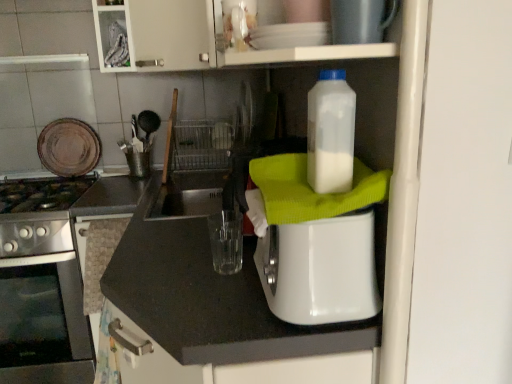
Locate an element on the screen. stainless steel gas stove at lower left is located at coordinates (38, 215).

What are the coordinates of `translucent plastic bottle at upper right` in the screenshot? It's located at (331, 133).

Describe the element at coordinates (331, 133) in the screenshot. The height and width of the screenshot is (384, 512). I see `translucent plastic bottle at upper right` at that location.

Measure the distance between point (10, 276) and camera.

The depth of point (10, 276) is 6.07 feet.

Describe the element at coordinates (198, 39) in the screenshot. The height and width of the screenshot is (384, 512). I see `white matte cabinet at upper center` at that location.

Find the location of a particular element. The height and width of the screenshot is (384, 512). stainless steel gas stove at lower left is located at coordinates (38, 215).

From the picture: Between brown matte plate at upper left, which is the third appliance in front-to-back order, and translucent plastic bottle at upper right, which one has larger width?

Wider between the two is translucent plastic bottle at upper right.

From the image's perspective, is brown matte plate at upper left, arranged as the first appliance when viewed from the left, positioned above or below translucent plastic bottle at upper right?

From the image's perspective, brown matte plate at upper left, arranged as the first appliance when viewed from the left, appears above translucent plastic bottle at upper right.

Does brown matte plate at upper left, the first appliance from the back, touch translucent plastic bottle at upper right?

No, brown matte plate at upper left, the first appliance from the back, is not in contact with translucent plastic bottle at upper right.

Does point (59, 169) appear closer or farther from the camera than point (349, 86)?

Point (59, 169).

From the image's perspective, which object appears higher, brown matte plate at upper left, the first appliance from the back, or stainless steel oven at left?

From the image's view, brown matte plate at upper left, the first appliance from the back, is above.

I want to click on home appliance lying below the brown matte plate at upper left, which is the third appliance in front-to-back order (from the image's perspective), so click(x=41, y=285).

From a real-world perspective, does stainless steel gas stove at lower left stand above brown matte plate at upper left, which is the third appliance in front-to-back order?

No, from a real-world perspective, stainless steel gas stove at lower left is not over brown matte plate at upper left, which is the third appliance in front-to-back order

Does point (22, 243) come farther from viewer compared to point (62, 135)?

No, it is not.

Is stainless steel gas stove at lower left at the left side of brown matte plate at upper left, arranged as the first appliance when viewed from the left?

Correct, you'll find stainless steel gas stove at lower left to the left of brown matte plate at upper left, arranged as the first appliance when viewed from the left.

Is stainless steel gas stove at lower left positioned far away from brown matte plate at upper left, which is counted as the third appliance, starting from the right?

stainless steel gas stove at lower left is near brown matte plate at upper left, which is counted as the third appliance, starting from the right, not far away.

Considering the sizes of objects white plastic toaster at center, the second appliance from the left, and translucent plastic bottle at upper right in the image provided, who is shorter, white plastic toaster at center, the second appliance from the left, or translucent plastic bottle at upper right?

translucent plastic bottle at upper right is shorter.

Is white plastic toaster at center, which ranks as the 2th appliance in back-to-front order, positioned with its back to translucent plastic bottle at upper right?

white plastic toaster at center, which ranks as the 2th appliance in back-to-front order, is not turned away from translucent plastic bottle at upper right.

Is white plastic toaster at center, which ranks as the second appliance in right-to-left order, spatially inside translucent plastic bottle at upper right, or outside of it?

The correct answer is: outside.

This screenshot has width=512, height=384. I want to click on appliance that appears below the translucent plastic bottle at upper right (from the image's perspective), so click(x=317, y=243).

Is translucent plastic bottle at upper right oriented towards white matte cabinet at upper center?

No.

Considering the relative sizes of translucent plastic bottle at upper right and white matte cabinet at upper center in the image provided, is translucent plastic bottle at upper right bigger than white matte cabinet at upper center?

Actually, translucent plastic bottle at upper right might be smaller than white matte cabinet at upper center.

The width and height of the screenshot is (512, 384). Identify the location of bottle in front of the white matte cabinet at upper center. (331, 133).

Between point (44, 187) and point (381, 33), which one is positioned behind?

The point (44, 187) is farther from the camera.

Is stainless steel oven at left situated inside metallic silver toaster at upper center, the third appliance when ordered from left to right, or outside?

stainless steel oven at left is located beyond the bounds of metallic silver toaster at upper center, the third appliance when ordered from left to right.

From the image's perspective, starting from the stainless steel oven at left, which appliance is the 3rd one above? Please provide its 2D coordinates.

[(360, 20)]

Is stainless steel oven at left beside metallic silver toaster at upper center, marked as the first appliance in a right-to-left arrangement?

No, stainless steel oven at left is not next to metallic silver toaster at upper center, marked as the first appliance in a right-to-left arrangement.

In the scene shown: From the image's perspective, is metallic silver toaster at upper center, the third appliance from the back, located above or below white plastic toaster at center, which ranks as the 2th appliance in back-to-front order?

Clearly, from the image's perspective, metallic silver toaster at upper center, the third appliance from the back, is above white plastic toaster at center, which ranks as the 2th appliance in back-to-front order.

Is metallic silver toaster at upper center, the first appliance positioned from the front, located outside white plastic toaster at center, marked as the 2th appliance in a front-to-back arrangement?

Yes, metallic silver toaster at upper center, the first appliance positioned from the front, is outside of white plastic toaster at center, marked as the 2th appliance in a front-to-back arrangement.

Between metallic silver toaster at upper center, marked as the first appliance in a right-to-left arrangement, and white plastic toaster at center, which ranks as the second appliance in right-to-left order, which one has more height?

Standing taller between the two is white plastic toaster at center, which ranks as the second appliance in right-to-left order.

How many degrees apart are the facing directions of metallic silver toaster at upper center, the third appliance from the back, and white plastic toaster at center, marked as the 2th appliance in a front-to-back arrangement?

2.78 degrees separate the facing orientations of metallic silver toaster at upper center, the third appliance from the back, and white plastic toaster at center, marked as the 2th appliance in a front-to-back arrangement.

Find the location of a particular element. This screenshot has width=512, height=384. appliance that is the 1st one when counting upward from the translucent plastic bottle at upper right (from the image's perspective) is located at coordinates (69, 147).

The height and width of the screenshot is (384, 512). In order to click on appliance that is the 1st object to the right of the stainless steel oven at left, starting at the anchor in this screenshot , I will do `click(69, 147)`.

When comparing their distances from metallic silver toaster at upper center, marked as the first appliance in a right-to-left arrangement, does white matte cabinet at upper center or translucent plastic bottle at upper right seem closer?

translucent plastic bottle at upper right is positioned closer to the anchor metallic silver toaster at upper center, marked as the first appliance in a right-to-left arrangement.

Considering their positions, is brown matte plate at upper left, arranged as the first appliance when viewed from the left, positioned further to stainless steel gas stove at lower left than white plastic toaster at center, the second appliance from the left?

Among the two, white plastic toaster at center, the second appliance from the left, is located further to stainless steel gas stove at lower left.

From the picture: From the image, which object appears to be farther from stainless steel gas stove at lower left, white plastic toaster at center, which ranks as the 2th appliance in back-to-front order, or metallic silver toaster at upper center, marked as the first appliance in a right-to-left arrangement?

Based on the image, metallic silver toaster at upper center, marked as the first appliance in a right-to-left arrangement, appears to be further to stainless steel gas stove at lower left.

Consider the image. Which object lies nearer to the anchor point white matte cabinet at upper center, white plastic toaster at center, which ranks as the second appliance in right-to-left order, or metallic silver toaster at upper center, the third appliance when ordered from left to right?

Among the two, white plastic toaster at center, which ranks as the second appliance in right-to-left order, is located nearer to white matte cabinet at upper center.

Looking at the image, which one is located further to white plastic toaster at center, which ranks as the 2th appliance in back-to-front order, stainless steel oven at left or white matte cabinet at upper center?

Among the two, stainless steel oven at left is located further to white plastic toaster at center, which ranks as the 2th appliance in back-to-front order.

Estimate the real-world distances between objects in this image. Which object is further from white matte cabinet at upper center, translucent plastic bottle at upper right or brown matte plate at upper left, which is the third appliance in front-to-back order?

Among the two, brown matte plate at upper left, which is the third appliance in front-to-back order, is located further to white matte cabinet at upper center.

When comparing their distances from translucent plastic bottle at upper right, does white plastic toaster at center, which ranks as the second appliance in right-to-left order, or brown matte plate at upper left, arranged as the first appliance when viewed from the left, seem closer?

Based on the image, white plastic toaster at center, which ranks as the second appliance in right-to-left order, appears to be nearer to translucent plastic bottle at upper right.

When comparing their distances from white matte cabinet at upper center, does brown matte plate at upper left, which is the third appliance in front-to-back order, or metallic silver toaster at upper center, the third appliance from the back, seem closer?

Among the two, brown matte plate at upper left, which is the third appliance in front-to-back order, is located nearer to white matte cabinet at upper center.

Find the location of a particular element. This screenshot has height=384, width=512. bottle between white matte cabinet at upper center and white plastic toaster at center, which ranks as the second appliance in right-to-left order, in the vertical direction is located at coordinates (331, 133).

Where is `appliance between metallic silver toaster at upper center, the third appliance when ordered from left to right, and brown matte plate at upper left, arranged as the first appliance when viewed from the left, in the front-back direction`? appliance between metallic silver toaster at upper center, the third appliance when ordered from left to right, and brown matte plate at upper left, arranged as the first appliance when viewed from the left, in the front-back direction is located at coordinates (317, 243).

You are a GUI agent. You are given a task and a screenshot of the screen. Output one action in this format:
    pyautogui.click(x=<x>, y=<y>)
    Task: Click on the home appliance between white plastic toaster at center, which ranks as the second appliance in right-to-left order, and brown matte plate at upper left, which is counted as the third appliance, starting from the right, in the front-back direction
    The image size is (512, 384).
    Given the screenshot: What is the action you would take?
    pyautogui.click(x=41, y=285)

Locate an element on the screen. The image size is (512, 384). gas stove between stainless steel oven at left and metallic silver toaster at upper center, the third appliance from the back, in the horizontal direction is located at coordinates (38, 215).